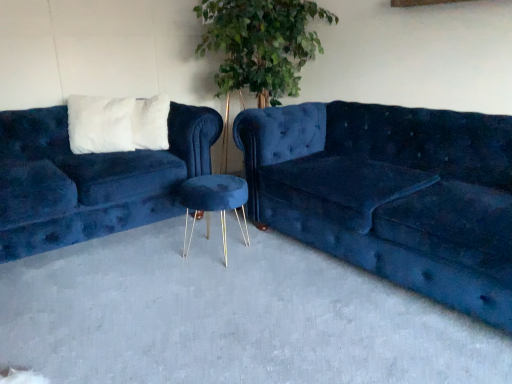
What are the coordinates of `velvet blue couch at left, marked as the 2th studio couch in a right-to-left arrangement` in the screenshot? It's located at click(x=91, y=179).

The width and height of the screenshot is (512, 384). Describe the element at coordinates (214, 203) in the screenshot. I see `velvet blue stool at center` at that location.

Identify the location of velvet blue couch at center, marked as the second studio couch in a left-to-right arrangement. (392, 194).

From a real-world perspective, which object stands above the other?

velvet blue couch at center, which ranks as the 1th studio couch in right-to-left order.

Which object is positioned more to the left, velvet blue couch at center, marked as the second studio couch in a left-to-right arrangement, or blue velvet stool at center?

From the viewer's perspective, blue velvet stool at center appears more on the left side.

Which of these two, velvet blue couch at center, which ranks as the 1th studio couch in right-to-left order, or blue velvet stool at center, is wider?

blue velvet stool at center is wider.

Are velvet blue couch at center, which ranks as the 1th studio couch in right-to-left order, and blue velvet stool at center making contact?

velvet blue couch at center, which ranks as the 1th studio couch in right-to-left order, and blue velvet stool at center are clearly separated.

Is velvet blue couch at left, which ranks as the first studio couch in left-to-right order, wider than velvet blue couch at center, which ranks as the 1th studio couch in right-to-left order?

In fact, velvet blue couch at left, which ranks as the first studio couch in left-to-right order, might be narrower than velvet blue couch at center, which ranks as the 1th studio couch in right-to-left order.

Does point (114, 230) lie in front of point (339, 235)?

No, (114, 230) is behind (339, 235).

Consider the image. Could you measure the distance between velvet blue couch at left, which ranks as the first studio couch in left-to-right order, and velvet blue couch at center, marked as the second studio couch in a left-to-right arrangement?

The distance of velvet blue couch at left, which ranks as the first studio couch in left-to-right order, from velvet blue couch at center, marked as the second studio couch in a left-to-right arrangement, is 37.32 inches.

Are velvet blue couch at left, which ranks as the first studio couch in left-to-right order, and velvet blue couch at center, marked as the second studio couch in a left-to-right arrangement, far apart?

No, there isn't a large distance between velvet blue couch at left, which ranks as the first studio couch in left-to-right order, and velvet blue couch at center, marked as the second studio couch in a left-to-right arrangement.

From a real-world perspective, is blue velvet stool at center on velvet blue stool at center?

No, from a real-world perspective, blue velvet stool at center is not above velvet blue stool at center.

Can you confirm if blue velvet stool at center is shorter than velvet blue stool at center?

Indeed, blue velvet stool at center has a lesser height compared to velvet blue stool at center.

Can you see blue velvet stool at center touching velvet blue stool at center?

There is a gap between blue velvet stool at center and velvet blue stool at center.

Is the depth of blue velvet stool at center less than that of velvet blue stool at center?

That is True.

In the scene shown: Is velvet blue couch at left, marked as the 2th studio couch in a right-to-left arrangement, next to blue velvet stool at center and touching it?

No, velvet blue couch at left, marked as the 2th studio couch in a right-to-left arrangement, is not making contact with blue velvet stool at center.

Who is shorter, velvet blue couch at left, which ranks as the first studio couch in left-to-right order, or blue velvet stool at center?

blue velvet stool at center.

Is velvet blue couch at left, marked as the 2th studio couch in a right-to-left arrangement, positioned with its back to blue velvet stool at center?

velvet blue couch at left, marked as the 2th studio couch in a right-to-left arrangement, does not have its back to blue velvet stool at center.

From a real-world perspective, is velvet blue couch at left, which ranks as the first studio couch in left-to-right order, on blue velvet stool at center?

A: Yes, from a real-world perspective, velvet blue couch at left, which ranks as the first studio couch in left-to-right order, is over blue velvet stool at center

From the image's perspective, is velvet blue stool at center above or below velvet blue couch at center, which ranks as the 1th studio couch in right-to-left order?

velvet blue stool at center is below velvet blue couch at center, which ranks as the 1th studio couch in right-to-left order.

Is velvet blue stool at center not close to velvet blue couch at center, marked as the second studio couch in a left-to-right arrangement?

No, velvet blue stool at center is in close proximity to velvet blue couch at center, marked as the second studio couch in a left-to-right arrangement.

Find the location of a particular element. This screenshot has height=384, width=512. bar stool below the velvet blue couch at center, marked as the second studio couch in a left-to-right arrangement (from a real-world perspective) is located at coordinates (214, 203).

From a real-world perspective, is velvet blue stool at center over velvet blue couch at center, marked as the second studio couch in a left-to-right arrangement?

No, from a real-world perspective, velvet blue stool at center is not above velvet blue couch at center, marked as the second studio couch in a left-to-right arrangement.

Is velvet blue stool at center beside blue velvet stool at center?

No, velvet blue stool at center is not beside blue velvet stool at center.

Looking at this image, would you say velvet blue stool at center is outside blue velvet stool at center?

Absolutely, velvet blue stool at center is external to blue velvet stool at center.

Is point (218, 185) positioned behind point (129, 359)?

Yes, point (218, 185) is farther from viewer.

Consider the image. Is velvet blue stool at center in front of blue velvet stool at center?

No, it is behind blue velvet stool at center.

From the image's perspective, is blue velvet stool at center over velvet blue couch at center, which ranks as the 1th studio couch in right-to-left order?

No, from the image's perspective, blue velvet stool at center is not over velvet blue couch at center, which ranks as the 1th studio couch in right-to-left order.

Is blue velvet stool at center oriented towards velvet blue couch at center, which ranks as the 1th studio couch in right-to-left order?

No.

Between blue velvet stool at center and velvet blue couch at center, which ranks as the 1th studio couch in right-to-left order, which one is positioned behind?

velvet blue couch at center, which ranks as the 1th studio couch in right-to-left order.

From the picture: Measure the distance between blue velvet stool at center and velvet blue couch at center, which ranks as the 1th studio couch in right-to-left order.

blue velvet stool at center is 22.09 inches from velvet blue couch at center, which ranks as the 1th studio couch in right-to-left order.

Image resolution: width=512 pixels, height=384 pixels. Identify the location of concrete that is in front of the velvet blue couch at center, which ranks as the 1th studio couch in right-to-left order. (229, 316).

This screenshot has width=512, height=384. In the image, there is a velvet blue couch at left, marked as the 2th studio couch in a right-to-left arrangement. Identify the location of studio couch below it (from the image's perspective). (392, 194).

Considering their positions, is blue velvet stool at center positioned closer to velvet blue stool at center than velvet blue couch at center, marked as the second studio couch in a left-to-right arrangement?

The object closer to velvet blue stool at center is blue velvet stool at center.

Estimate the real-world distances between objects in this image. Which object is further from blue velvet stool at center, velvet blue couch at left, which ranks as the first studio couch in left-to-right order, or velvet blue couch at center, which ranks as the 1th studio couch in right-to-left order?

Among the two, velvet blue couch at left, which ranks as the first studio couch in left-to-right order, is located further to blue velvet stool at center.

When comparing their distances from velvet blue couch at left, which ranks as the first studio couch in left-to-right order, does velvet blue stool at center or velvet blue couch at center, which ranks as the 1th studio couch in right-to-left order, seem closer?

velvet blue stool at center is positioned closer to the anchor velvet blue couch at left, which ranks as the first studio couch in left-to-right order.

Considering their positions, is velvet blue couch at center, marked as the second studio couch in a left-to-right arrangement, positioned closer to velvet blue stool at center than blue velvet stool at center?

blue velvet stool at center is closer to velvet blue stool at center.

In the scene shown: Which object lies further to the anchor point velvet blue couch at center, marked as the second studio couch in a left-to-right arrangement, velvet blue couch at left, which ranks as the first studio couch in left-to-right order, or velvet blue stool at center?

velvet blue couch at left, which ranks as the first studio couch in left-to-right order.

When comparing their distances from velvet blue couch at left, which ranks as the first studio couch in left-to-right order, does velvet blue couch at center, marked as the second studio couch in a left-to-right arrangement, or velvet blue stool at center seem closer?

The object closer to velvet blue couch at left, which ranks as the first studio couch in left-to-right order, is velvet blue stool at center.

From the picture: Looking at the image, which one is located further to velvet blue couch at center, marked as the second studio couch in a left-to-right arrangement, blue velvet stool at center or velvet blue couch at left, which ranks as the first studio couch in left-to-right order?

velvet blue couch at left, which ranks as the first studio couch in left-to-right order, is positioned further to the anchor velvet blue couch at center, marked as the second studio couch in a left-to-right arrangement.

Based on their spatial positions, is velvet blue couch at left, marked as the 2th studio couch in a right-to-left arrangement, or blue velvet stool at center closer to velvet blue stool at center?

blue velvet stool at center is closer to velvet blue stool at center.

Where is `concrete between velvet blue couch at left, marked as the 2th studio couch in a right-to-left arrangement, and velvet blue couch at center, marked as the second studio couch in a left-to-right arrangement`? Image resolution: width=512 pixels, height=384 pixels. concrete between velvet blue couch at left, marked as the 2th studio couch in a right-to-left arrangement, and velvet blue couch at center, marked as the second studio couch in a left-to-right arrangement is located at coordinates (229, 316).

Locate an element on the screen. Image resolution: width=512 pixels, height=384 pixels. bar stool between velvet blue couch at left, marked as the 2th studio couch in a right-to-left arrangement, and velvet blue couch at center, marked as the second studio couch in a left-to-right arrangement is located at coordinates pos(214,203).